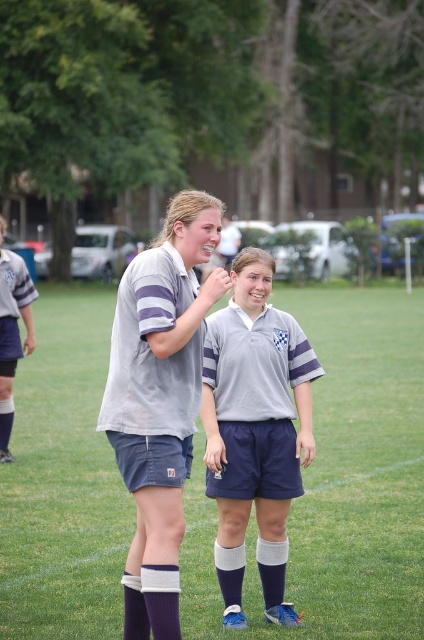
Question: From the image, what is the correct spatial relationship of matte gray shirt at center in relation to matte gray shorts at left?

Choices:
 (A) right
 (B) left

Answer: (A)

Question: Can you confirm if white fabric shorts at center is positioned to the right of white knit sock at lower center?

Choices:
 (A) yes
 (B) no

Answer: (A)

Question: Which point appears closest to the camera in this image?

Choices:
 (A) (142, 564)
 (B) (225, 541)
 (C) (36, 436)

Answer: (A)

Question: Among these points, which one is farthest from the camera?

Choices:
 (A) (176, 486)
 (B) (159, 589)
 (C) (0, 260)
 (D) (239, 364)

Answer: (C)

Question: Is matte gray uniform at center positioned at the back of white knit sock at lower center?

Choices:
 (A) no
 (B) yes

Answer: (B)

Question: Which of these objects is positioned closest to the white knit sock at lower center?

Choices:
 (A) matte gray uniform at center
 (B) matte gray shorts at left
 (C) matte gray shirt at center
 (D) white fabric shorts at center

Answer: (C)